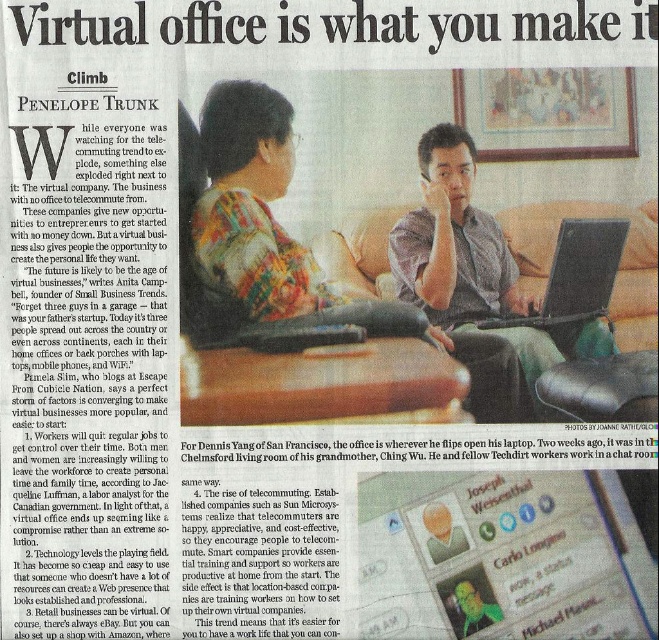
You are a photographer trying to capture a closeup of the black matte laptop at center without including the matte gray shirt at center in the frame. Is this possible given their current positions?

The matte gray shirt at center is in front of the black matte laptop at center, so it would block the view. Therefore, it is not possible to capture a closeup of the black matte laptop at center without including the matte gray shirt at center in the frame.

You are a photographer adjusting your camera settings to focus on two specific points in the image. The first point is point (513,291) and the second is point (567,220). Which point should you focus on first if you want to ensure the closest object is in focus?

Point (513,291) is closer to the camera than point (567,220), so you should focus on point (513,291) first to ensure the closest object is in focus.